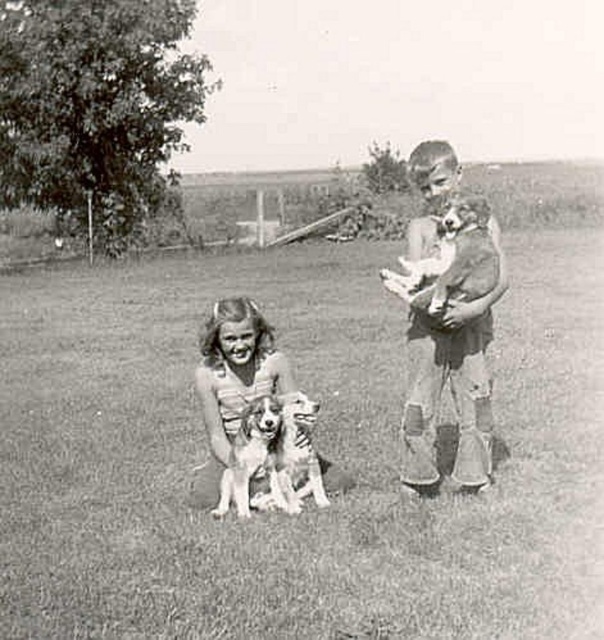
Question: Does soft fur dog at center have a larger size compared to soft fur dog at lower center?

Choices:
 (A) yes
 (B) no

Answer: (A)

Question: Which object appears farthest from the camera in this image?

Choices:
 (A) smooth fabric shirt at right
 (B) soft fur dog at lower center
 (C) soft fur dog at center
 (D) smooth fur dog at lower center

Answer: (D)

Question: Which point is farther from the camera taking this photo?

Choices:
 (A) (277, 490)
 (B) (245, 456)

Answer: (A)

Question: Does smooth fabric shirt at right appear over soft fur puppy at upper right?

Choices:
 (A) no
 (B) yes

Answer: (A)

Question: Based on their relative distances, which object is farther from the smooth fur dog at lower center?

Choices:
 (A) soft fur puppy at upper right
 (B) soft fur dog at lower center

Answer: (A)

Question: Is smooth fabric shirt at right above soft fur dog at lower center?

Choices:
 (A) yes
 (B) no

Answer: (A)